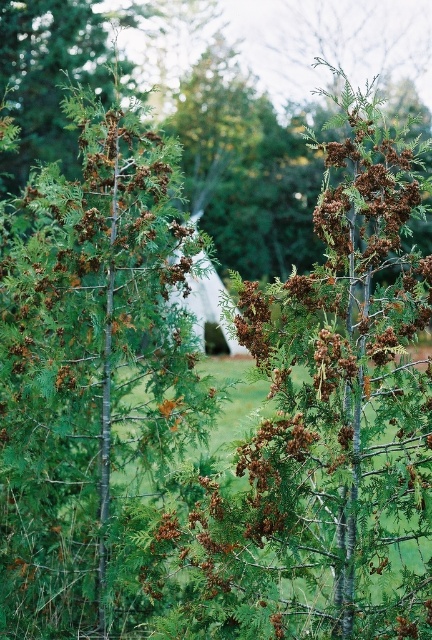
You are a gardener assessing two trees in the center of a park. You need to determine which tree is shorter. The trees are the brown textured tree at center and the green matte tree at center. Which one is shorter?

The brown textured tree at center is not as tall as the green matte tree at center, so the brown textured tree at center is shorter.

You are a gardener who wants to plant a new flower bed between the brown textured tree at center and the green matte tree at center. The flower bed requires a minimum of 20 inches of space. Based on the image, will there be enough space to plant the flower bed between them?

The brown textured tree at center is 21.51 inches from the green matte tree at center, which is more than the required 20 inches. Therefore, there is enough space to plant the flower bed between them.